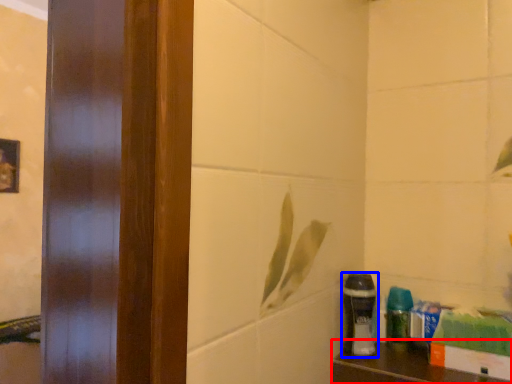
Question: Which object appears closest to the camera in this image, furniture (highlighted by a red box) or shaving cream (highlighted by a blue box)?

Choices:
 (A) furniture
 (B) shaving cream

Answer: (A)